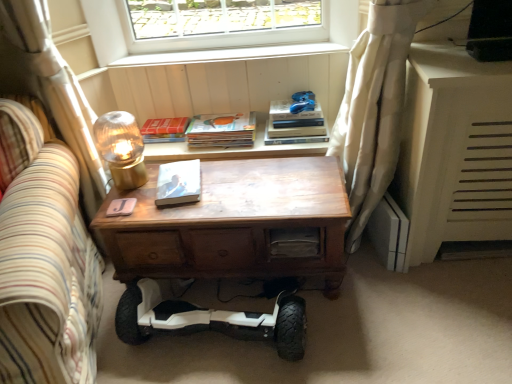
The image size is (512, 384). In order to click on vacant space underneath white matte segway at lower center (from a real-world perspective) in this screenshot , I will do `click(215, 345)`.